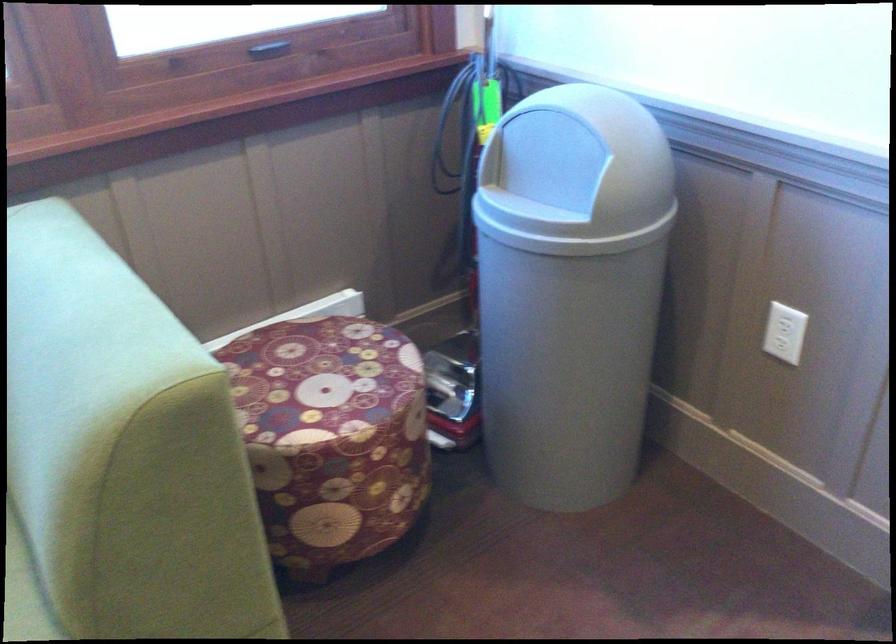
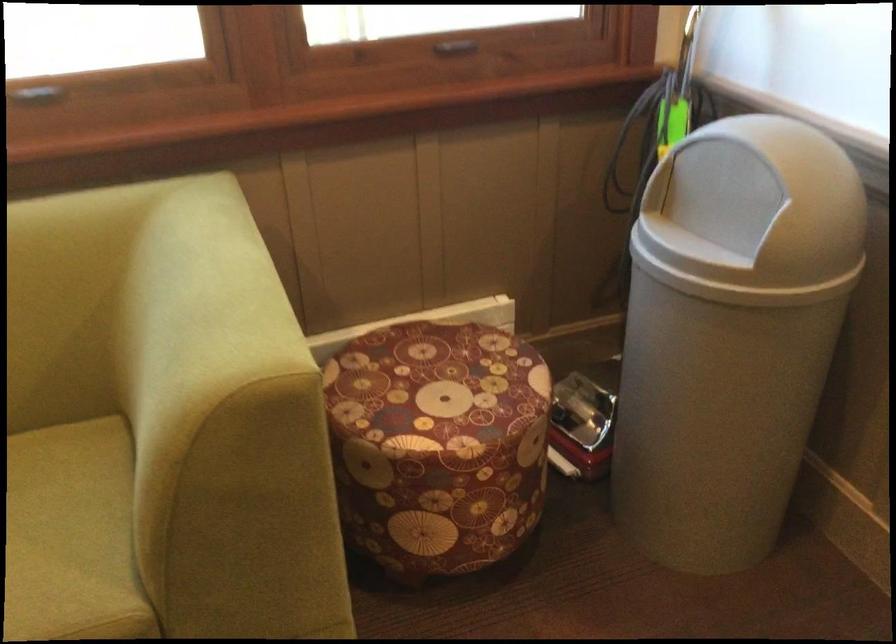
Question: The camera is either moving clockwise (left) or counter-clockwise (right) around the object. The first image is from the beginning of the video and the second image is from the end. Is the camera moving left or right when shooting the video?

Choices:
 (A) Left
 (B) Right

Answer: (B)